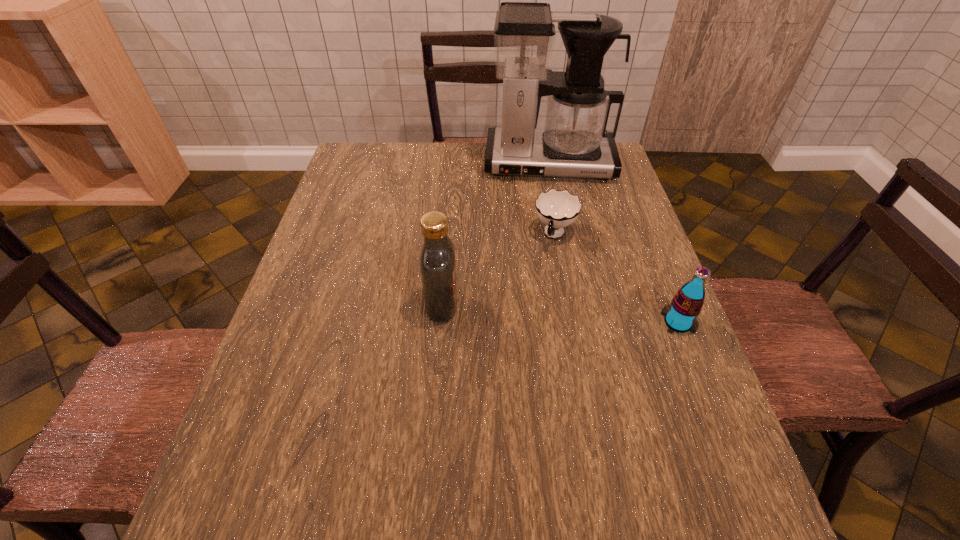
You are a GUI agent. You are given a task and a screenshot of the screen. Output one action in this format:
    pyautogui.click(x=<x>, y=<y>)
    Task: Click on the vacant space on the desktop that is between the leftmost object and the second shortest object and is positioned on the side of the cup with the handle
    This screenshot has width=960, height=540.
    Given the screenshot: What is the action you would take?
    click(528, 311)

The image size is (960, 540). What are the coordinates of `vacant space on the desktop that is between the third shortest object and the third tallest object and is positioned at the front of the coffee maker where the controls are located` in the screenshot? It's located at (560, 313).